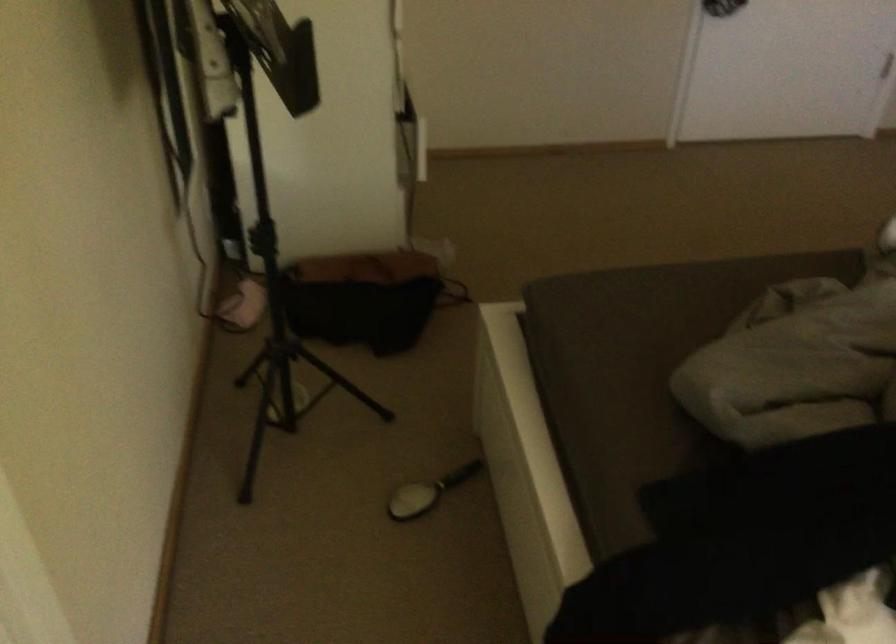
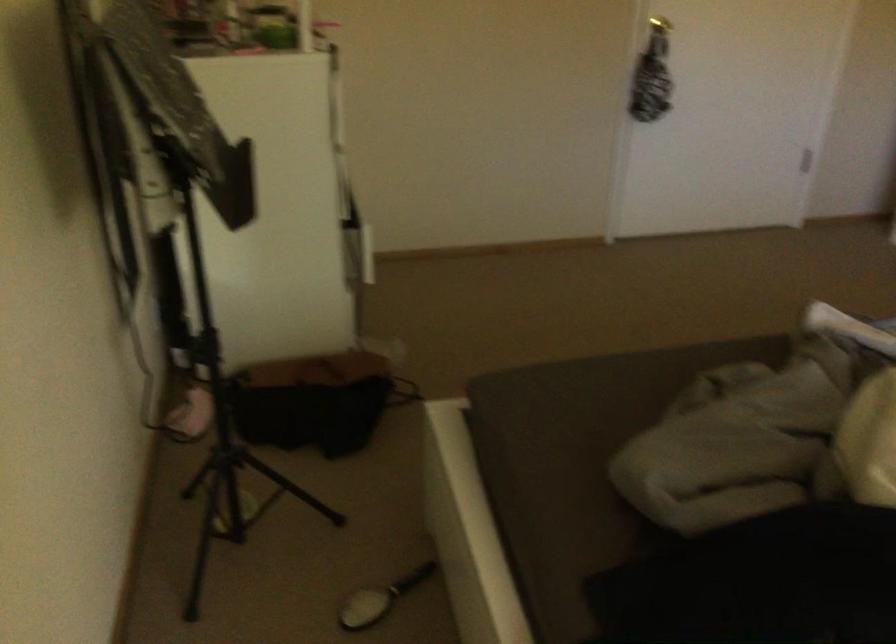
Locate, in the second image, the point that corresponds to (427,491) in the first image.

(380, 599)